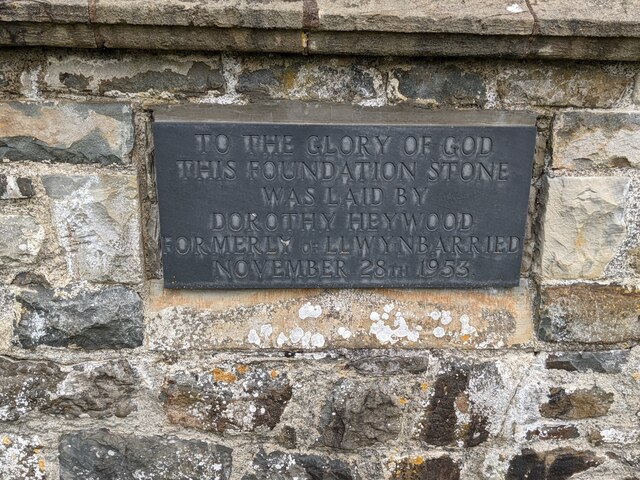
Identify the location of plaque. (319, 166).